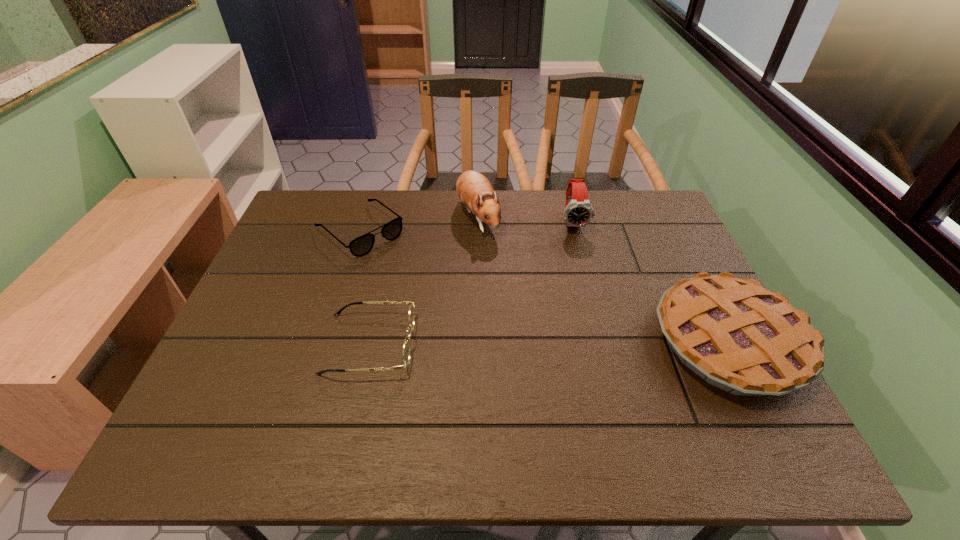
I want to click on vacant space located on the face of the watch, so click(x=596, y=322).

The width and height of the screenshot is (960, 540). I want to click on vacant space located 0.150m on the face of the watch, so click(585, 269).

Identify the location of blank area located 0.140m on the face of the watch. The image size is (960, 540). point(584,267).

Find the location of a particular element. This screenshot has width=960, height=540. vacant space located on the front-facing side of the farther spectacles is located at coordinates (396, 260).

Identify the location of free space located 0.170m on the front-facing side of the farther spectacles. (422, 281).

Where is `free space located 0.180m on the front-facing side of the farther spectacles`? The image size is (960, 540). free space located 0.180m on the front-facing side of the farther spectacles is located at coordinates (425, 283).

Image resolution: width=960 pixels, height=540 pixels. What are the coordinates of `hamster present at the far edge` in the screenshot? It's located at (473, 188).

Image resolution: width=960 pixels, height=540 pixels. I want to click on watch present at the far edge, so click(x=578, y=212).

Find the location of a particular element. spectacles located at the far edge is located at coordinates (360, 246).

You are a GUI agent. You are given a task and a screenshot of the screen. Output one action in this format:
    pyautogui.click(x=<x>, y=<y>)
    Task: Click on the spectacles at the near edge
    The width and height of the screenshot is (960, 540).
    Given the screenshot: What is the action you would take?
    pyautogui.click(x=406, y=347)